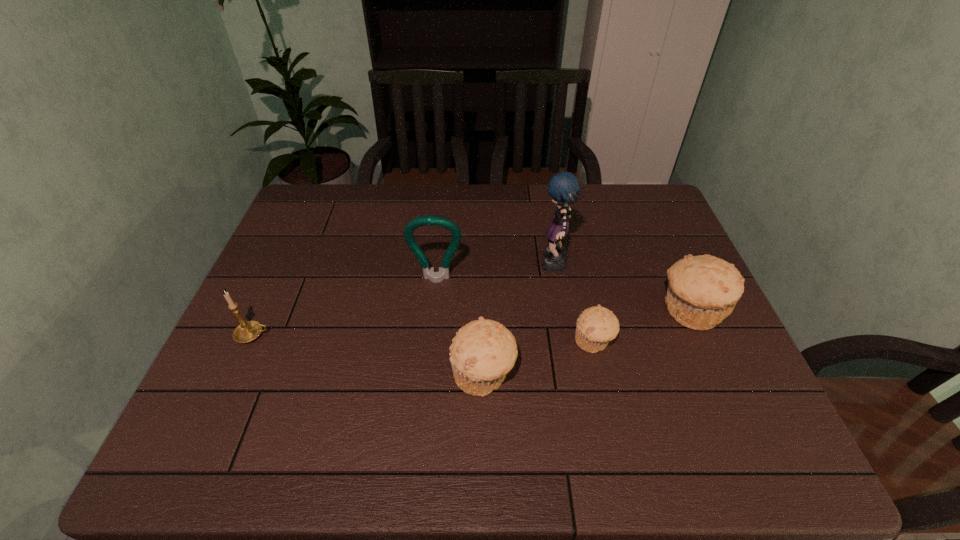
Find the location of a particular element. Image resolution: width=960 pixels, height=540 pixels. vacant space at the left edge of the desktop is located at coordinates (279, 281).

Where is `vacant space at the right edge of the desktop`? The image size is (960, 540). vacant space at the right edge of the desktop is located at coordinates (709, 363).

Where is `free space at the far left corner of the desktop`? The height and width of the screenshot is (540, 960). free space at the far left corner of the desktop is located at coordinates coord(348,187).

This screenshot has height=540, width=960. In the image, there is a desktop. Identify the location of vacant space at the near left corner. click(x=256, y=394).

This screenshot has width=960, height=540. Identify the location of unoccupied area between the bottle opener and the candle holder. (345, 307).

You are a GUI agent. You are given a task and a screenshot of the screen. Output one action in this format:
    pyautogui.click(x=<x>, y=<y>)
    Task: Click on the free area in between the second tallest object and the second shortest muffin
    The height and width of the screenshot is (540, 960).
    Given the screenshot: What is the action you would take?
    pyautogui.click(x=460, y=327)

Find the location of a particular element. The width and height of the screenshot is (960, 540). vacant space that's between the second shortest muffin and the tallest object is located at coordinates pyautogui.click(x=519, y=320).

Identify the location of vacant space that is in between the tallest object and the rightmost muffin. (623, 288).

Locate an element on the screen. This screenshot has height=540, width=960. vacant space that is in between the tallest object and the second tallest muffin is located at coordinates (519, 320).

Where is `free space between the rightmost muffin and the rag doll`? This screenshot has width=960, height=540. free space between the rightmost muffin and the rag doll is located at coordinates (623, 288).